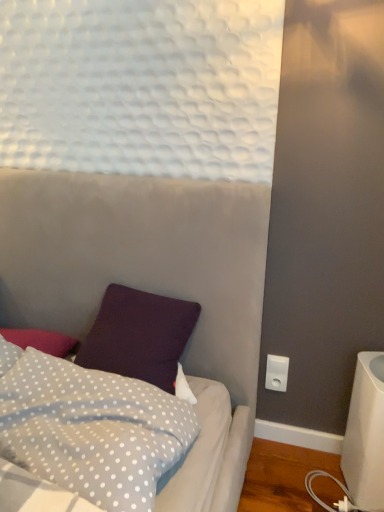
Locate an element on the screen. The height and width of the screenshot is (512, 384). white dotted fabric pillow at lower left is located at coordinates (91, 426).

This screenshot has width=384, height=512. Describe the element at coordinates (91, 426) in the screenshot. I see `white dotted fabric pillow at lower left` at that location.

Describe the element at coordinates (277, 373) in the screenshot. I see `white plastic electric outlet at lower right` at that location.

Measure the distance between white plastic electric outlet at lower right and camera.

white plastic electric outlet at lower right and camera are 5.60 feet apart from each other.

Where is `white plastic electric outlet at lower right`? The width and height of the screenshot is (384, 512). white plastic electric outlet at lower right is located at coordinates (277, 373).

Find the location of a particular element. white dotted fabric pillow at lower left is located at coordinates (91, 426).

Between white dotted fabric pillow at lower left and white plastic electric outlet at lower right, which one appears on the left side from the viewer's perspective?

From the viewer's perspective, white dotted fabric pillow at lower left appears more on the left side.

Which object is closer to the camera taking this photo, white dotted fabric pillow at lower left or white plastic electric outlet at lower right?

white dotted fabric pillow at lower left.

Is point (76, 424) closer or farther from the camera than point (282, 383)?

Clearly, point (76, 424) is closer to the camera than point (282, 383).

From the image's perspective, is white dotted fabric pillow at lower left positioned above or below white plastic electric outlet at lower right?

Clearly, from the image's perspective, white dotted fabric pillow at lower left is below white plastic electric outlet at lower right.

From a real-world perspective, which is physically below, white dotted fabric pillow at lower left or white plastic electric outlet at lower right?

From a 3D spatial view, white plastic electric outlet at lower right is below.

Can you confirm if white dotted fabric pillow at lower left is wider than white plastic electric outlet at lower right?

Indeed, white dotted fabric pillow at lower left has a greater width compared to white plastic electric outlet at lower right.

In terms of height, does white dotted fabric pillow at lower left look taller or shorter compared to white plastic electric outlet at lower right?

Considering their sizes, white dotted fabric pillow at lower left has more height than white plastic electric outlet at lower right.

Is white dotted fabric pillow at lower left bigger than white plastic electric outlet at lower right?

Yes.

Is white plastic electric outlet at lower right a part of white dotted fabric pillow at lower left?

No, white plastic electric outlet at lower right is not inside white dotted fabric pillow at lower left.

Is the surface of white dotted fabric pillow at lower left in direct contact with white plastic electric outlet at lower right?

They are not placed beside each other.

Is white plastic electric outlet at lower right at the back of white dotted fabric pillow at lower left?

Yes, white dotted fabric pillow at lower left's orientation is away from white plastic electric outlet at lower right.

Where is `pillow on the left of white plastic electric outlet at lower right`? The width and height of the screenshot is (384, 512). pillow on the left of white plastic electric outlet at lower right is located at coordinates (91, 426).

Considering the relative positions of white plastic electric outlet at lower right and white dotted fabric pillow at lower left in the image provided, is white plastic electric outlet at lower right to the left or to the right of white dotted fabric pillow at lower left?

white plastic electric outlet at lower right is to the right of white dotted fabric pillow at lower left.

In the image, is white plastic electric outlet at lower right positioned in front of or behind white dotted fabric pillow at lower left?

white plastic electric outlet at lower right is behind white dotted fabric pillow at lower left.

Between point (287, 369) and point (32, 348), which one is positioned in front?

The point (32, 348) is closer.

From the image's perspective, is white plastic electric outlet at lower right positioned above or below white dotted fabric pillow at lower left?

Clearly, from the image's perspective, white plastic electric outlet at lower right is above white dotted fabric pillow at lower left.

From a real-world perspective, does white plastic electric outlet at lower right stand above white dotted fabric pillow at lower left?

No.

Considering the sizes of objects white plastic electric outlet at lower right and white dotted fabric pillow at lower left in the image provided, who is thinner, white plastic electric outlet at lower right or white dotted fabric pillow at lower left?

white plastic electric outlet at lower right.

Considering the relative sizes of white plastic electric outlet at lower right and white dotted fabric pillow at lower left in the image provided, is white plastic electric outlet at lower right shorter than white dotted fabric pillow at lower left?

Yes, white plastic electric outlet at lower right is shorter than white dotted fabric pillow at lower left.

Is white plastic electric outlet at lower right bigger than white dotted fabric pillow at lower left?

Incorrect, white plastic electric outlet at lower right is not larger than white dotted fabric pillow at lower left.

Is white plastic electric outlet at lower right located outside white dotted fabric pillow at lower left?

white plastic electric outlet at lower right lies outside white dotted fabric pillow at lower left's area.

Based on the photo, is the surface of white plastic electric outlet at lower right in direct contact with white dotted fabric pillow at lower left?

No, white plastic electric outlet at lower right is not next to white dotted fabric pillow at lower left.

Is white plastic electric outlet at lower right positioned with its back to white dotted fabric pillow at lower left?

No, white plastic electric outlet at lower right's orientation is not away from white dotted fabric pillow at lower left.

The image size is (384, 512). I want to click on pillow lying on the left of white plastic electric outlet at lower right, so click(x=91, y=426).

Image resolution: width=384 pixels, height=512 pixels. What are the coordinates of `electric outlet that is above the white dotted fabric pillow at lower left (from the image's perspective)` in the screenshot? It's located at (277, 373).

Locate an element on the screen. Image resolution: width=384 pixels, height=512 pixels. electric outlet on the right of white dotted fabric pillow at lower left is located at coordinates (277, 373).